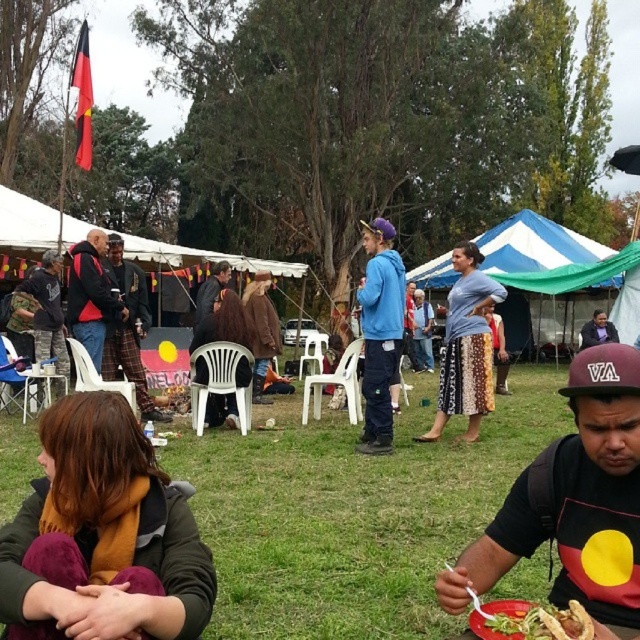
Question: Does matte black jacket at center lie behind green leafy salad at lower center?

Choices:
 (A) yes
 (B) no

Answer: (A)

Question: Is maroon fabric cap at center to the left of green leafy salad at lower center from the viewer's perspective?

Choices:
 (A) no
 (B) yes

Answer: (A)

Question: Which object is positioned closest to the patterned fabric skirt at center?

Choices:
 (A) brown wool scarf at lower left
 (B) matte blue hoodie at center

Answer: (B)

Question: Does green leafy salad at lower center have a greater width compared to blue denim jeans at center?

Choices:
 (A) yes
 (B) no

Answer: (B)

Question: Which object is closer to the camera taking this photo?

Choices:
 (A) patterned fabric skirt at center
 (B) brown wool scarf at lower left

Answer: (B)

Question: Which object is positioned farthest from the brown fuzzy coat at center?

Choices:
 (A) green leafy salad at lower center
 (B) matte black jacket at center

Answer: (A)